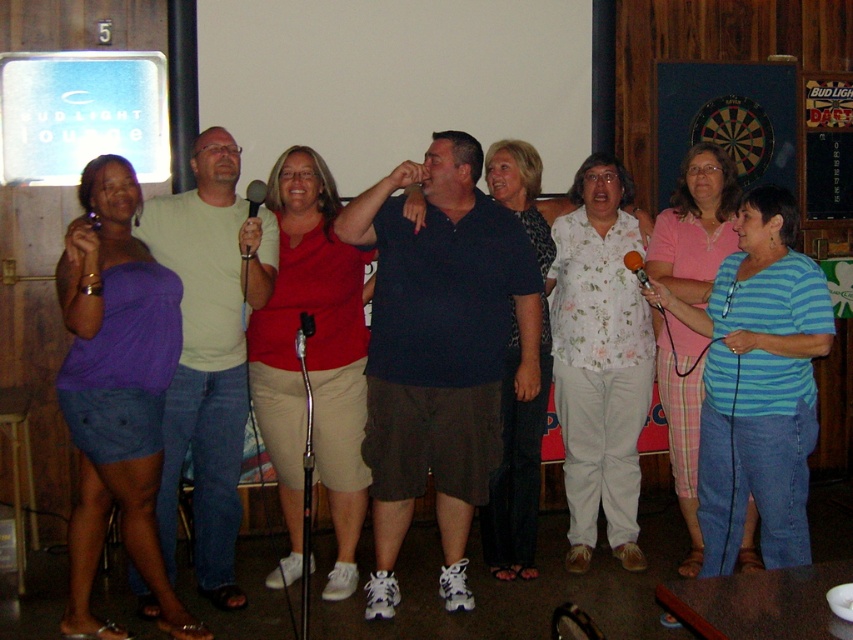
Which is in front, point (155, 488) or point (251, 204)?

Positioned in front is point (155, 488).

Which is below, purple satin dress at left or matte black microphone at center?

purple satin dress at left is lower down.

Is point (138, 452) in front of point (256, 189)?

Yes, it is.

At what (x,y) coordinates should I click in order to perform the action: click on purple satin dress at left. Please return your answer as a coordinate pair (x, y). Looking at the image, I should click on (115, 390).

Measure the distance between purple satin dress at left and matte red shirt at center.

23.02 inches

Who is positioned more to the left, purple satin dress at left or matte red shirt at center?

From the viewer's perspective, purple satin dress at left appears more on the left side.

This screenshot has width=853, height=640. Describe the element at coordinates (115, 390) in the screenshot. I see `purple satin dress at left` at that location.

The height and width of the screenshot is (640, 853). Identify the location of purple satin dress at left. (115, 390).

Does blue striped shirt at center appear under matte black microphone at center?

Yes, blue striped shirt at center is below matte black microphone at center.

Is blue striped shirt at center to the right of matte black microphone at center from the viewer's perspective?

Yes, blue striped shirt at center is to the right of matte black microphone at center.

Is point (659, 224) positioned before point (252, 186)?

No, (659, 224) is further to viewer.

Where is `blue striped shirt at center`? This screenshot has width=853, height=640. blue striped shirt at center is located at coordinates (695, 225).